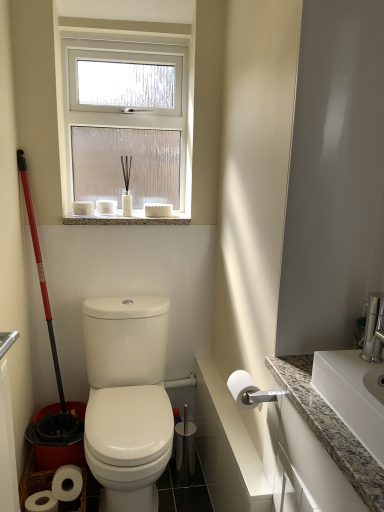
What do you see at coordinates (106, 206) in the screenshot? I see `white matte toilet paper at upper center, the second toilet paper in the bottom-to-top sequence` at bounding box center [106, 206].

This screenshot has width=384, height=512. In order to click on granite at upper center in this screenshot , I will do pyautogui.click(x=126, y=219).

Describe the element at coordinates (330, 428) in the screenshot. Image resolution: width=384 pixels, height=512 pixels. I see `granite countertop at right` at that location.

Describe the element at coordinates (357, 381) in the screenshot. I see `white granite sink at right` at that location.

Image resolution: width=384 pixels, height=512 pixels. Find the location of `white matte toilet paper at upper center, positioned as the 2th toilet paper in front-to-back order`. white matte toilet paper at upper center, positioned as the 2th toilet paper in front-to-back order is located at coordinates (83, 207).

How many degrees apart are the facing directions of clear glass window at upper center and white matte toilet paper at right, which is the 1th toilet paper from right to left?

0.231 degrees separate the facing orientations of clear glass window at upper center and white matte toilet paper at right, which is the 1th toilet paper from right to left.

Is clear glass window at upper center oriented towards white matte toilet paper at right, which is the 1th toilet paper from right to left?

Yes, clear glass window at upper center is turned towards white matte toilet paper at right, which is the 1th toilet paper from right to left.

Is clear glass window at upper center at the left side of white matte toilet paper at right, which is counted as the first toilet paper, starting from the bottom?

Indeed, clear glass window at upper center is positioned on the left side of white matte toilet paper at right, which is counted as the first toilet paper, starting from the bottom.

From the image's perspective, would you say clear glass window at upper center is positioned over white matte toilet paper at right, which is the 1th toilet paper from right to left?

Correct, clear glass window at upper center appears higher than white matte toilet paper at right, which is the 1th toilet paper from right to left, in the image.

How different are the orientations of white matte toilet paper at upper center, which appears as the 1th toilet paper when viewed from the top, and granite countertop at right in degrees?

They differ by 89.1 degrees in their facing directions.

Is white matte toilet paper at upper center, the 1th toilet paper in the left-to-right sequence, shorter than granite countertop at right?

Yes.

Is white matte toilet paper at upper center, positioned as the 2th toilet paper in front-to-back order, aimed at granite countertop at right?

No, white matte toilet paper at upper center, positioned as the 2th toilet paper in front-to-back order, does not turn towards granite countertop at right.

Do you think white matte toilet paper at upper center, positioned as the 2th toilet paper in front-to-back order, is within granite countertop at right, or outside of it?

white matte toilet paper at upper center, positioned as the 2th toilet paper in front-to-back order, is not inside granite countertop at right, it's outside.

Between granite countertop at right and white matte toilet paper at upper center, arranged as the 2th toilet paper when viewed from the back, which one has more height?

granite countertop at right.

Locate an element on the screen. This screenshot has height=512, width=384. counter top on the right of white matte toilet paper at upper center, positioned as the 2th toilet paper in front-to-back order is located at coordinates (330, 428).

From a real-world perspective, who is located lower, granite countertop at right or white matte toilet paper at upper center, arranged as the 2th toilet paper when viewed from the back?

From a 3D spatial view, granite countertop at right is below.

Is point (378, 465) closer or farther from the camera than point (75, 201)?

Clearly, point (378, 465) is closer to the camera than point (75, 201).

From a real-world perspective, which is physically below, clear glass window at upper center or granite at upper center?

granite at upper center.

From the picture: Which of these two, clear glass window at upper center or granite at upper center, is wider?

granite at upper center.

Would you say granite at upper center is part of clear glass window at upper center's contents?

No, clear glass window at upper center does not contain granite at upper center.

Locate an element on the screen. Image resolution: width=384 pixels, height=512 pixels. window sill located below the clear glass window at upper center (from the image's perspective) is located at coordinates (126, 219).

Is granite at upper center positioned with its back to white glossy toilet at center?

No, granite at upper center is not facing the opposite direction of white glossy toilet at center.

Between granite at upper center and white glossy toilet at center, which one has smaller size?

granite at upper center.

Considering the sizes of objects granite at upper center and white glossy toilet at center in the image provided, who is taller, granite at upper center or white glossy toilet at center?

white glossy toilet at center is taller.

Is the depth of granite at upper center less than that of white glossy toilet at center?

No, granite at upper center is behind white glossy toilet at center.

Is the surface of white glossy toilet at center in direct contact with white matte toilet paper at upper center, the 2th toilet paper when ordered from top to bottom?

No, white glossy toilet at center is not next to white matte toilet paper at upper center, the 2th toilet paper when ordered from top to bottom.

Is point (101, 364) less distant than point (104, 200)?

Yes, it is.

Can you confirm if white glossy toilet at center is smaller than white matte toilet paper at upper center, the 1th toilet paper when ordered from back to front?

No, white glossy toilet at center is not smaller than white matte toilet paper at upper center, the 1th toilet paper when ordered from back to front.

Which object is thinner, white glossy toilet at center or white matte toilet paper at upper center, marked as the second toilet paper in a right-to-left arrangement?

white matte toilet paper at upper center, marked as the second toilet paper in a right-to-left arrangement, is thinner.

Locate an element on the screen. The height and width of the screenshot is (512, 384). window sill behind the white glossy toilet at center is located at coordinates (126, 219).

Is granite at upper center completely or partially inside white glossy toilet at center?

Definitely not — granite at upper center is not inside white glossy toilet at center.

Which of these two, white glossy toilet at center or granite at upper center, is bigger?

Bigger between the two is white glossy toilet at center.

Locate an element on the screen. The height and width of the screenshot is (512, 384). toilet paper that is the 3rd one below the clear glass window at upper center (from a real-world perspective) is located at coordinates (242, 389).

Image resolution: width=384 pixels, height=512 pixels. I want to click on the 3rd toilet paper counting from the left of the granite countertop at right, so [83, 207].

Looking at the image, which one is located closer to white matte toilet paper at upper center, the second toilet paper in the bottom-to-top sequence, white glossy toilet at center or white matte toilet paper at upper center, which appears as the third toilet paper when viewed from the right?

white matte toilet paper at upper center, which appears as the third toilet paper when viewed from the right.

Looking at the image, which one is located further to granite at upper center, white matte toilet paper at upper center, the second toilet paper in the bottom-to-top sequence, or granite countertop at right?

granite countertop at right.

When comparing their distances from granite countertop at right, does white glossy toilet at center or white matte toilet paper at upper center, arranged as the 2th toilet paper when viewed from the back, seem closer?

Among the two, white glossy toilet at center is located nearer to granite countertop at right.

Based on their spatial positions, is white granite sink at right or granite countertop at right closer to white matte toilet paper at right, the 3th toilet paper from the left?

granite countertop at right.

Considering their positions, is white granite sink at right positioned closer to white matte toilet paper at upper center, which appears as the 1th toilet paper when viewed from the top, than white glossy toilet at center?

The object closer to white matte toilet paper at upper center, which appears as the 1th toilet paper when viewed from the top, is white glossy toilet at center.

Looking at the image, which one is located closer to white glossy toilet at center, granite countertop at right or clear glass window at upper center?

granite countertop at right is positioned closer to the anchor white glossy toilet at center.

Based on their spatial positions, is white matte toilet paper at upper center, marked as the second toilet paper in a right-to-left arrangement, or white granite sink at right closer to white matte toilet paper at upper center, arranged as the 2th toilet paper when viewed from the back?

Among the two, white matte toilet paper at upper center, marked as the second toilet paper in a right-to-left arrangement, is located nearer to white matte toilet paper at upper center, arranged as the 2th toilet paper when viewed from the back.

Which object lies further to the anchor point granite countertop at right, white glossy toilet at center or clear glass window at upper center?

Based on the image, clear glass window at upper center appears to be further to granite countertop at right.

Image resolution: width=384 pixels, height=512 pixels. I want to click on window sill located between white granite sink at right and white matte toilet paper at upper center, acting as the 3th toilet paper starting from the front, in the depth direction, so click(x=126, y=219).

You are a GUI agent. You are given a task and a screenshot of the screen. Output one action in this format:
    pyautogui.click(x=<x>, y=<y>)
    Task: Click on the sink positioned between granite countertop at right and granite at upper center from near to far
    The image size is (384, 512).
    Given the screenshot: What is the action you would take?
    pyautogui.click(x=357, y=381)

You are a GUI agent. You are given a task and a screenshot of the screen. Output one action in this format:
    pyautogui.click(x=<x>, y=<y>)
    Task: Click on the toilet positioned between granite countertop at right and white matte toilet paper at upper center, the second toilet paper viewed from the left, from near to far
    Image resolution: width=384 pixels, height=512 pixels.
    Given the screenshot: What is the action you would take?
    pyautogui.click(x=127, y=399)

I want to click on window positioned between white granite sink at right and white matte toilet paper at upper center, marked as the second toilet paper in a right-to-left arrangement, from near to far, so click(127, 122).